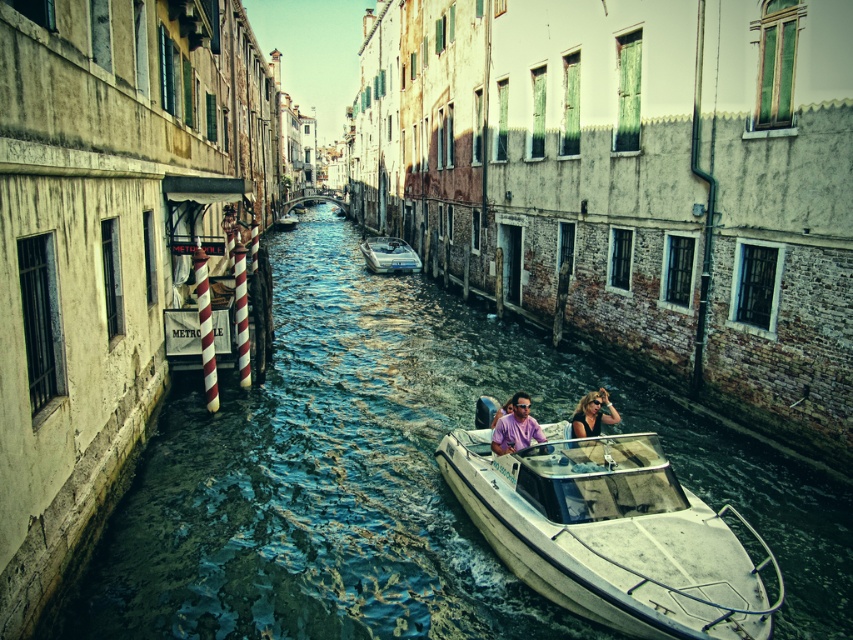
Question: Is matte pink shirt at center smaller than purple matte shirt at center?

Choices:
 (A) yes
 (B) no

Answer: (B)

Question: Which object appears farthest from the camera in this image?

Choices:
 (A) white glossy boat at center
 (B) matte black hair at center
 (C) shiny metallic boat at center
 (D) matte pink shirt at center

Answer: (A)

Question: Which object is farther from the camera taking this photo?

Choices:
 (A) matte black hair at center
 (B) metallic silver boat at center
 (C) white glossy boat at center
 (D) purple matte shirt at center

Answer: (C)

Question: Considering the relative positions of shiny metallic boat at center and white glossy boat at center in the image provided, where is shiny metallic boat at center located with respect to white glossy boat at center?

Choices:
 (A) left
 (B) right

Answer: (B)

Question: Estimate the real-world distances between objects in this image. Which object is closer to the purple matte shirt at center?

Choices:
 (A) shiny metallic boat at center
 (B) white glossy boat at center
 (C) matte black hair at center

Answer: (C)

Question: Does matte pink shirt at center have a smaller size compared to purple matte shirt at center?

Choices:
 (A) no
 (B) yes

Answer: (A)